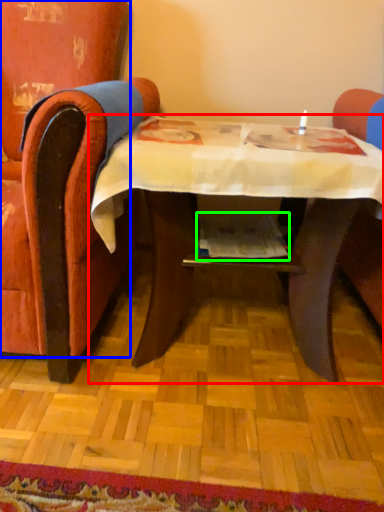
Question: Considering the real-world distances, which object is farthest from table (highlighted by a red box)? chair (highlighted by a blue box) or magazine (highlighted by a green box)?

Choices:
 (A) chair
 (B) magazine

Answer: (A)